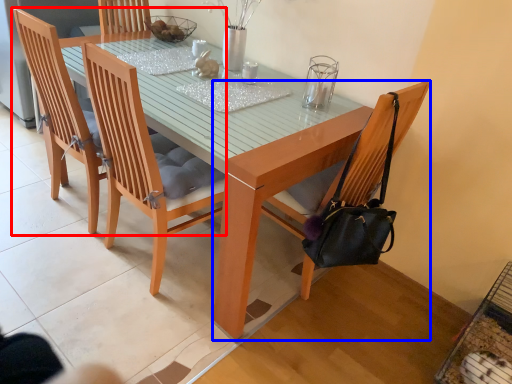
Question: Which point is further to the camera, chair (highlighted by a red box) or chair (highlighted by a blue box)?

Choices:
 (A) chair
 (B) chair

Answer: (A)